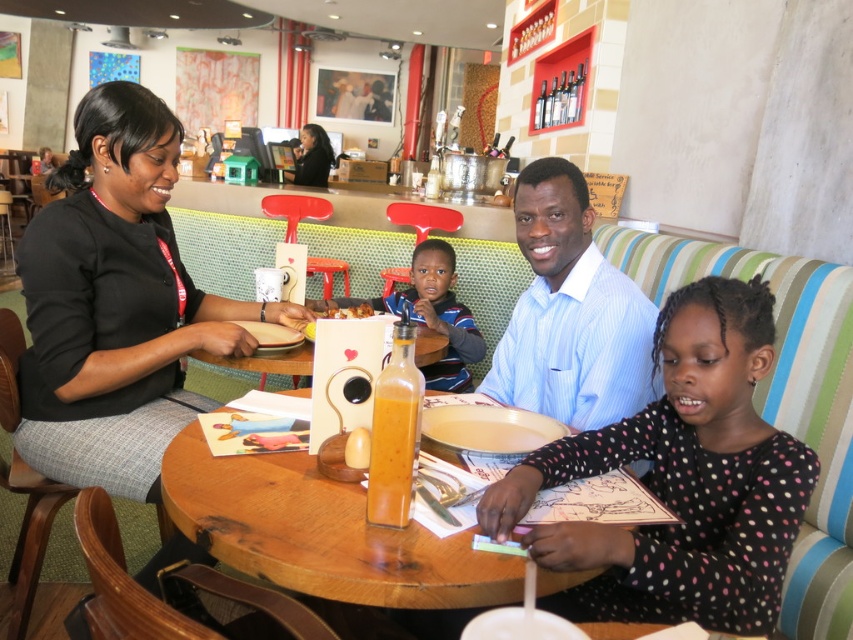
You are a waiter at the restaurant and need to place a large dessert plate on the table. Which table should you choose between the wooden table at center and the wooden round table at center?

The wooden table at center has a larger size compared to the wooden round table at center, so you should choose the wooden table at center to place the large dessert plate.